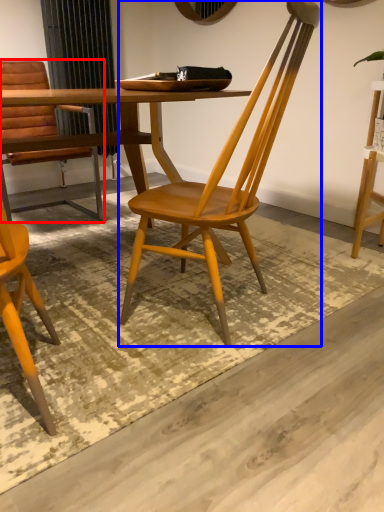
Question: Which point is closer to the camera, chair (highlighted by a red box) or chair (highlighted by a blue box)?

Choices:
 (A) chair
 (B) chair

Answer: (B)